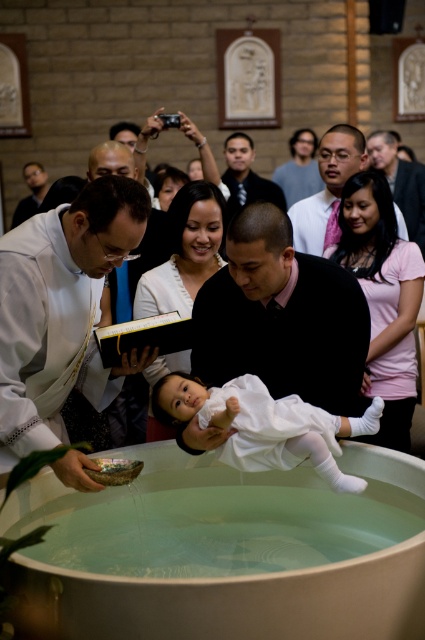
Which is more to the left, black matte shirt at center or matte black robe at upper left?

Positioned to the left is matte black robe at upper left.

Is black matte shirt at center positioned at the back of matte black robe at upper left?

No, it is in front of matte black robe at upper left.

Who is more distant from viewer, (266, 228) or (16, 224)?

The point (16, 224) is more distant.

Identify the location of black matte shirt at center. The width and height of the screenshot is (425, 640). (280, 316).

Does white clothed priest at left lie behind gray sweater at upper center?

No.

Does white clothed priest at left appear under gray sweater at upper center?

Correct, white clothed priest at left is located below gray sweater at upper center.

This screenshot has width=425, height=640. Describe the element at coordinates (61, 308) in the screenshot. I see `white clothed priest at left` at that location.

The image size is (425, 640). I want to click on white clothed priest at left, so click(61, 308).

In the scene shown: Is white clothed priest at left smaller than matte black robe at upper left?

Incorrect, white clothed priest at left is not smaller in size than matte black robe at upper left.

Consider the image. Is white clothed priest at left behind matte black robe at upper left?

No, it is not.

Where is `white clothed priest at left`? This screenshot has width=425, height=640. white clothed priest at left is located at coordinates (61, 308).